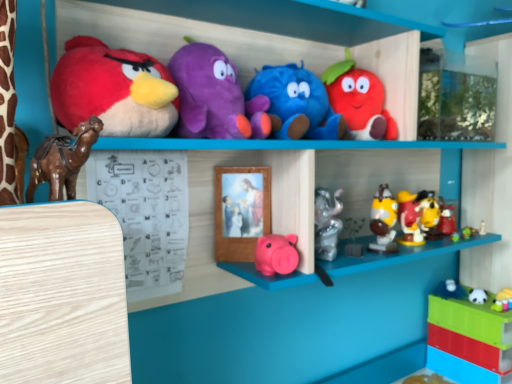
Question: Could you tell me if shiny plastic toys at center right, which ranks as the 5th toy in right-to-left order, is turned towards yellow matte figurine at right, which is the 4th toy in right-to-left order?

Choices:
 (A) yes
 (B) no

Answer: (B)

Question: Is shiny plastic toys at center right, the 7th toy positioned from the left, to the right of yellow matte figurine at right, the 8th toy positioned from the left, from the viewer's perspective?

Choices:
 (A) no
 (B) yes

Answer: (A)

Question: Does shiny plastic toys at center right, the 7th toy positioned from the left, have a lesser height compared to yellow matte figurine at right, which is the 4th toy in right-to-left order?

Choices:
 (A) no
 (B) yes

Answer: (A)

Question: Is there a large distance between shiny plastic toys at center right, the 7th toy positioned from the left, and yellow matte figurine at right, the 8th toy positioned from the left?

Choices:
 (A) yes
 (B) no

Answer: (B)

Question: Is shiny plastic toys at center right, which ranks as the 5th toy in right-to-left order, positioned behind yellow matte figurine at right, the 8th toy positioned from the left?

Choices:
 (A) yes
 (B) no

Answer: (B)

Question: Does shiny plastic toys at center right, the 7th toy positioned from the left, have a larger size compared to yellow matte figurine at right, the 8th toy positioned from the left?

Choices:
 (A) no
 (B) yes

Answer: (B)

Question: From a real-world perspective, is matte plush strawberry at upper center, which is counted as the seventh toy, starting from the right, under blue plush toy at upper center, marked as the 8th toy in a right-to-left arrangement?

Choices:
 (A) yes
 (B) no

Answer: (B)

Question: Is matte plush strawberry at upper center, which appears as the 5th toy when viewed from the left, further to camera compared to blue plush toy at upper center, placed as the fourth toy when sorted from left to right?

Choices:
 (A) yes
 (B) no

Answer: (A)

Question: Considering the relative sizes of matte plush strawberry at upper center, which is counted as the seventh toy, starting from the right, and blue plush toy at upper center, placed as the fourth toy when sorted from left to right, in the image provided, is matte plush strawberry at upper center, which is counted as the seventh toy, starting from the right, wider than blue plush toy at upper center, placed as the fourth toy when sorted from left to right,?

Choices:
 (A) yes
 (B) no

Answer: (B)

Question: From the image's perspective, is matte plush strawberry at upper center, which is counted as the seventh toy, starting from the right, on top of blue plush toy at upper center, placed as the fourth toy when sorted from left to right?

Choices:
 (A) no
 (B) yes

Answer: (B)

Question: Is matte plush strawberry at upper center, which appears as the 5th toy when viewed from the left, positioned in front of blue plush toy at upper center, marked as the 8th toy in a right-to-left arrangement?

Choices:
 (A) no
 (B) yes

Answer: (A)

Question: Does matte plush strawberry at upper center, which appears as the 5th toy when viewed from the left, appear on the right side of blue plush toy at upper center, placed as the fourth toy when sorted from left to right?

Choices:
 (A) yes
 (B) no

Answer: (A)

Question: Is blue plush toy at upper center, marked as the 8th toy in a right-to-left arrangement, at the left side of shiny plastic toys at center right, which ranks as the 5th toy in right-to-left order?

Choices:
 (A) yes
 (B) no

Answer: (A)